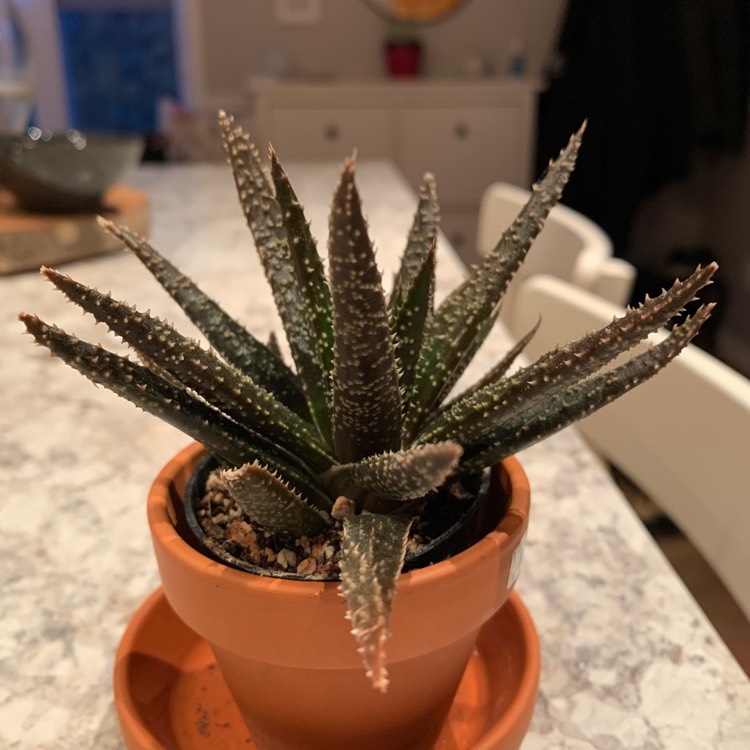
Identify the location of wood cutting board. (75, 238).